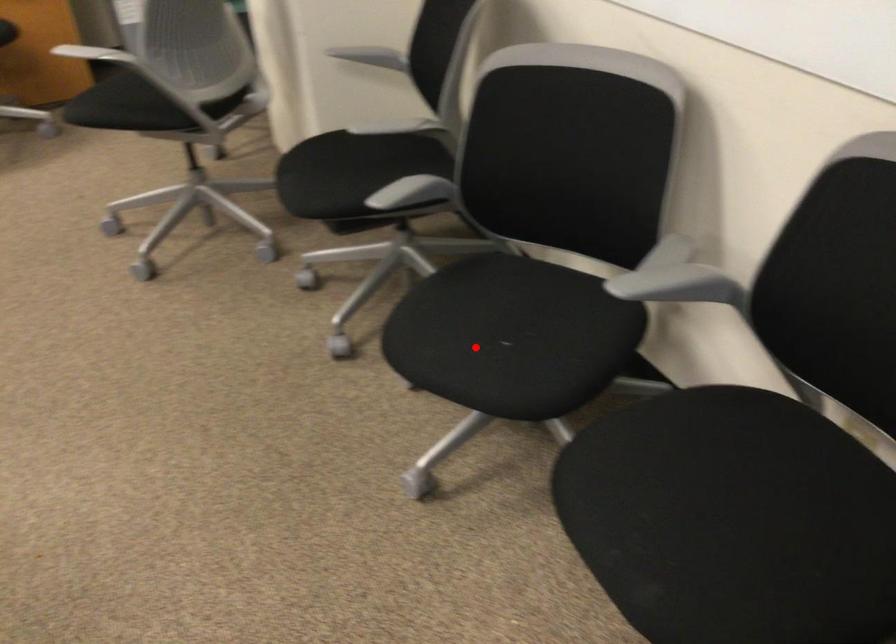
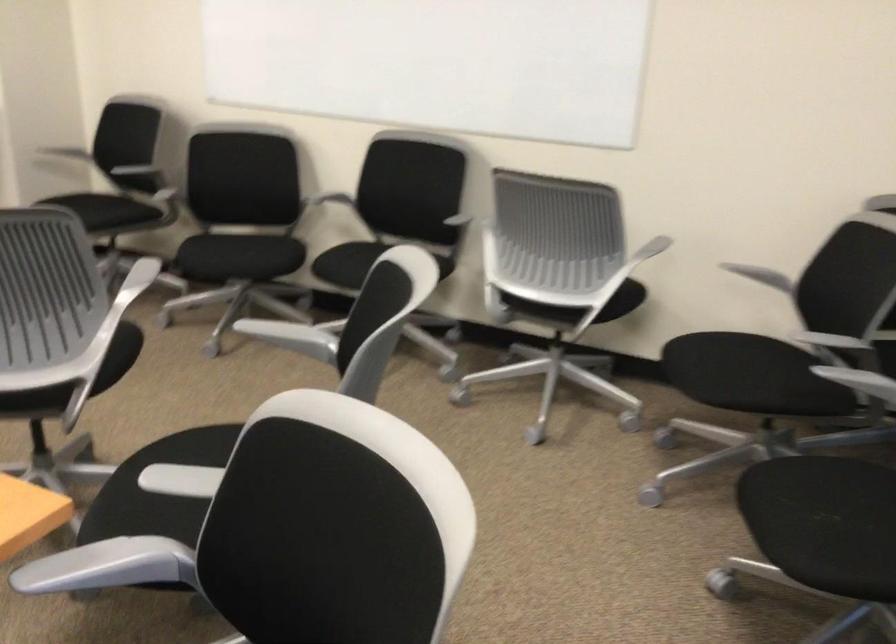
Question: I am providing you with two images of the same scene from different viewpoints. In image1, a red point is highlighted. Considering the same 3D point in image2, which of the following is correct?

Choices:
 (A) It is closer
 (B) It is farther

Answer: (B)